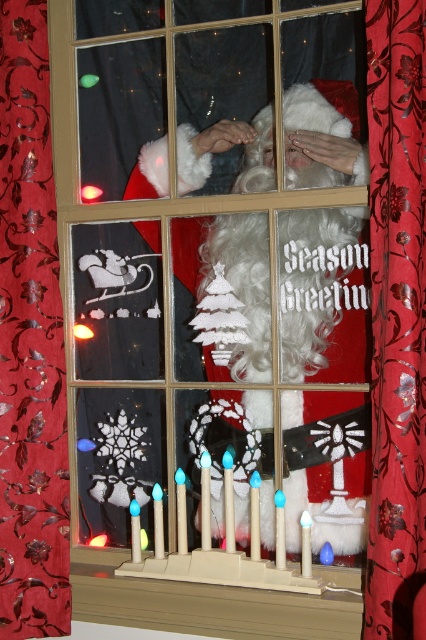
Question: Among these points, which one is farthest from the camera?

Choices:
 (A) [x=8, y=401]
 (B) [x=74, y=612]
 (C) [x=397, y=204]

Answer: (B)

Question: Among these points, which one is nearest to the camera?

Choices:
 (A) (419, 36)
 (B) (63, 401)
 (C) (256, 632)

Answer: (A)

Question: Does red floral fabric curtain at left appear under red velvet curtain at center?

Choices:
 (A) yes
 (B) no

Answer: (A)

Question: Among these objects, which one is nearest to the camera?

Choices:
 (A) red floral fabric curtain at left
 (B) beige wood at lower center
 (C) red velvet curtain at center

Answer: (C)

Question: Is red floral fabric curtain at left to the right of red velvet curtain at center from the viewer's perspective?

Choices:
 (A) no
 (B) yes

Answer: (A)

Question: Can you confirm if red floral fabric curtain at left is positioned to the left of red velvet curtain at center?

Choices:
 (A) yes
 (B) no

Answer: (A)